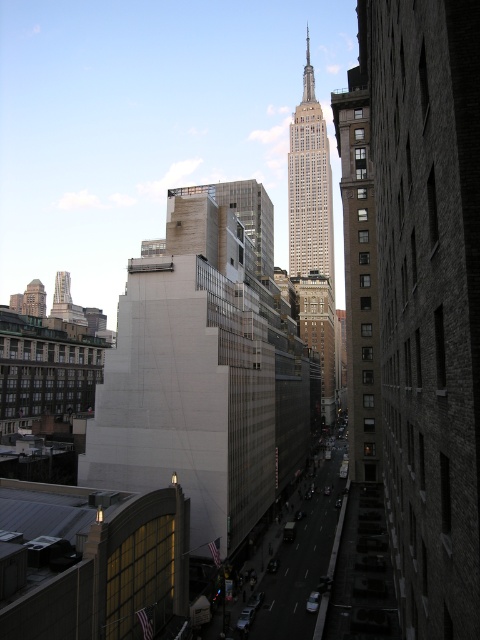
You are standing on a rooftop and looking at two points in the scene. The first point is at coordinates point (348,257) and the second is at point (302,262). Which point is closer to you?

Point (348,257) is closer to the camera than point (302,262).

You are standing at the center of the street and want to locate the brown brick building at right. What are its coordinates on the image?

The coordinates of the brown brick building at right are at point [360,273].

You are standing on a rooftop and looking at the city. There is a point marked at coordinates (360,273). What does this point indicate?

The point at coordinates (360,273) marks the location of the brown brick building at right.